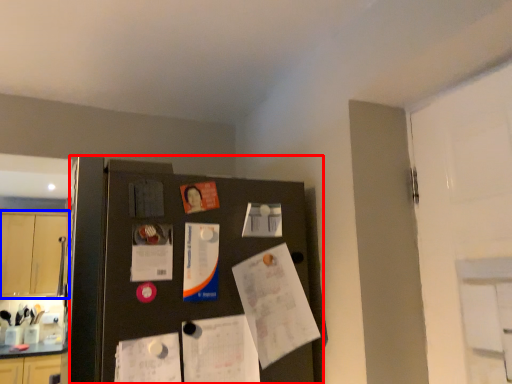
Question: Which object appears farthest to the camera in this image, fridge (highlighted by a red box) or cabinetry (highlighted by a blue box)?

Choices:
 (A) fridge
 (B) cabinetry

Answer: (B)